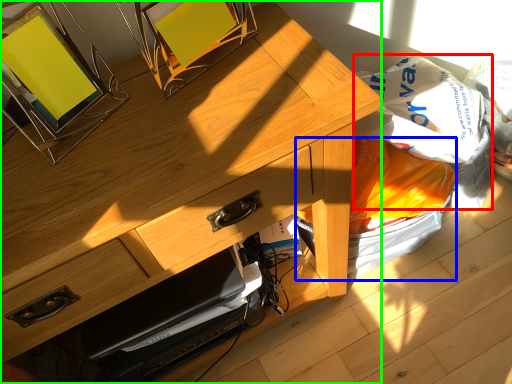
Question: Based on their relative distances, which object is nearer to grocery bag (highlighted by a red box)? Choose from garbage (highlighted by a blue box) and desk (highlighted by a green box).

Choices:
 (A) garbage
 (B) desk

Answer: (A)